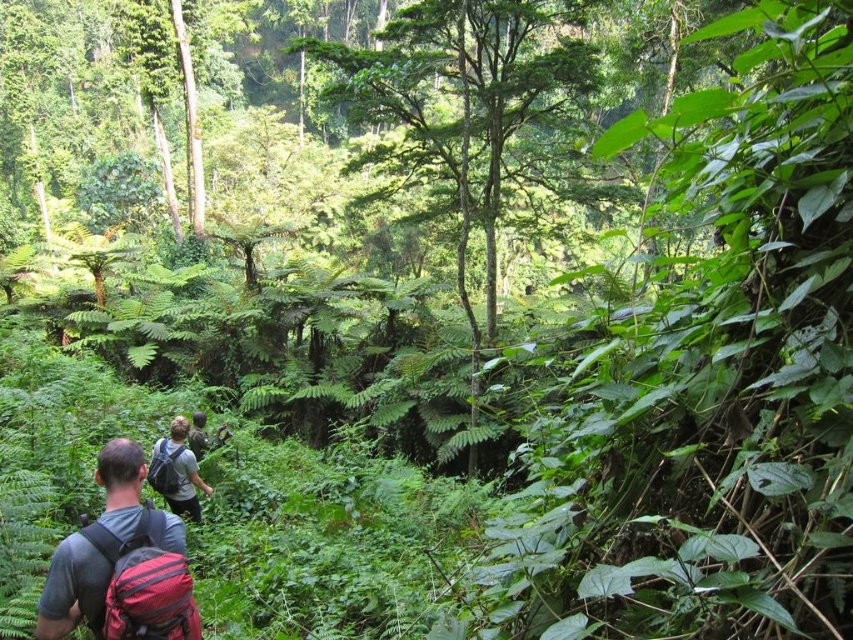
Based on the photo, you are a hiker trying to follow the path in the forest. You see the red fabric backpack at lower left and the matte gray backpack at center. Which backpack is closer to you?

The red fabric backpack at lower left is closer to you because it is in front of the matte gray backpack at center.

You are a hiker who needs to choose between the matte gray backpack at center and the matte red backpack at lower left. Which backpack is taller?

The matte gray backpack at center is much taller than the matte red backpack at lower left according to the description.